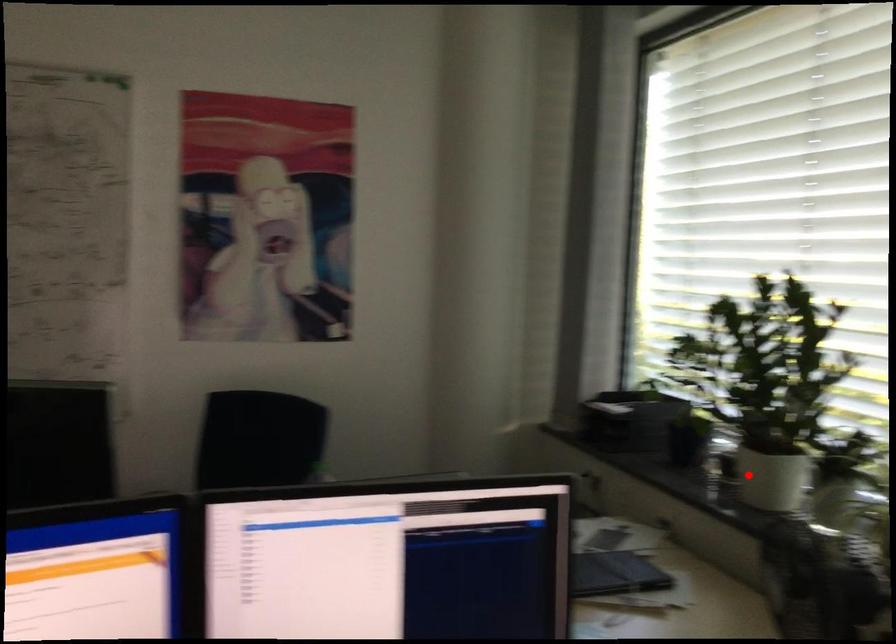
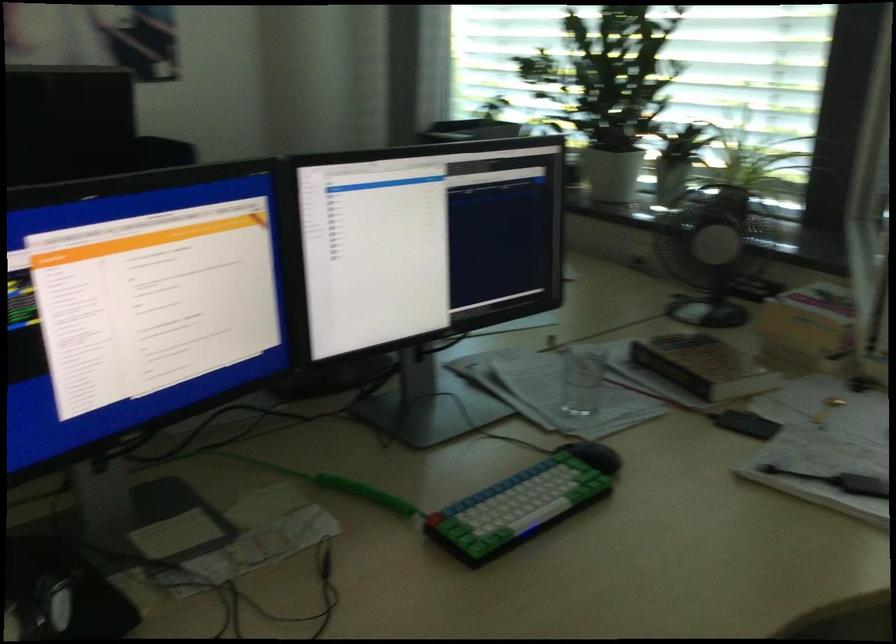
Question: I am providing you with two images of the same scene from different viewpoints. Image1 has a red point marked. In image2, the corresponding 3D location appears at what relative position? Reply with the corresponding letter.

Choices:
 (A) Closer
 (B) Farther

Answer: (B)